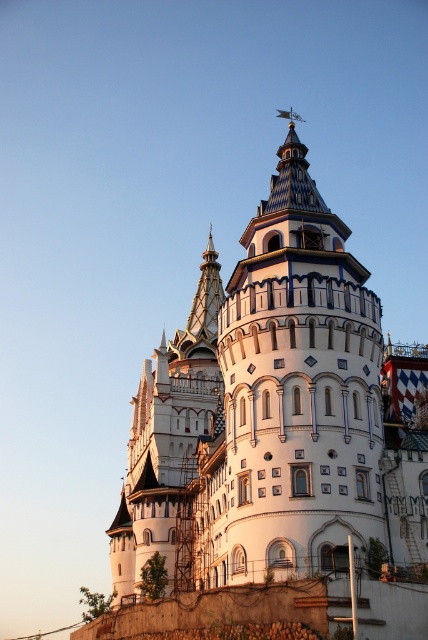
You are standing at point [294,396] in the image of the grand building. What object is located exactly at your current position?

The white ceramic tower at center is located exactly at point [294,396].

You are an architect designing a model of this building. You have two towers to place on the model. The white ceramic tower at center and the white stone tower at center. Which tower should you place first if you want to ensure proper spacing between them?

You should place the white stone tower at center first because it occupies more space than the white ceramic tower at center, allowing for better spacing management.

You are an architect examining the grand building and notice two towers at the center. Which one is shorter in height between the white ceramic tower at center and the white stone tower at center?

The white ceramic tower at center is shorter than the white stone tower at center.